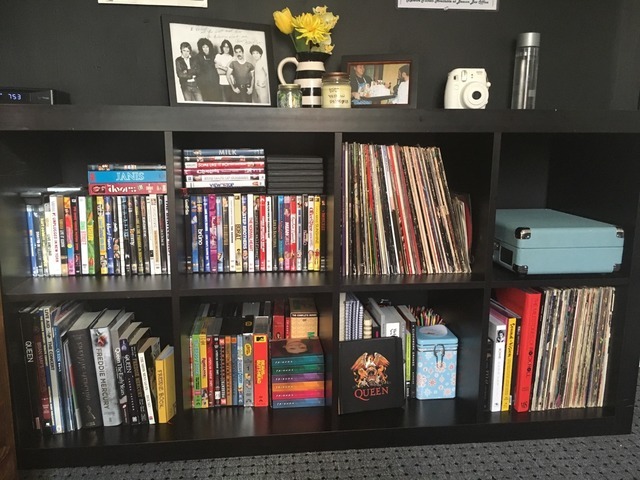
Where is `vase`? vase is located at coordinates tap(310, 79).